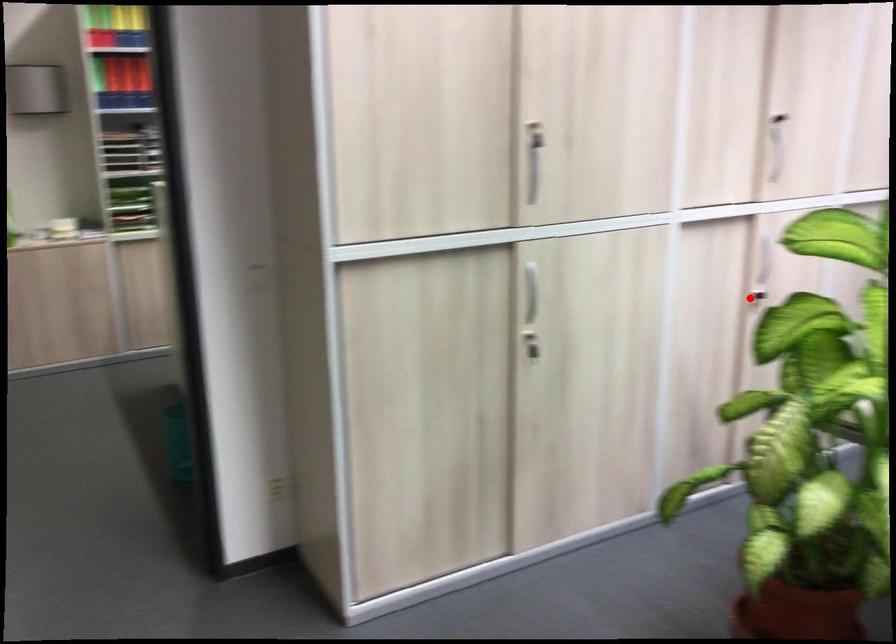
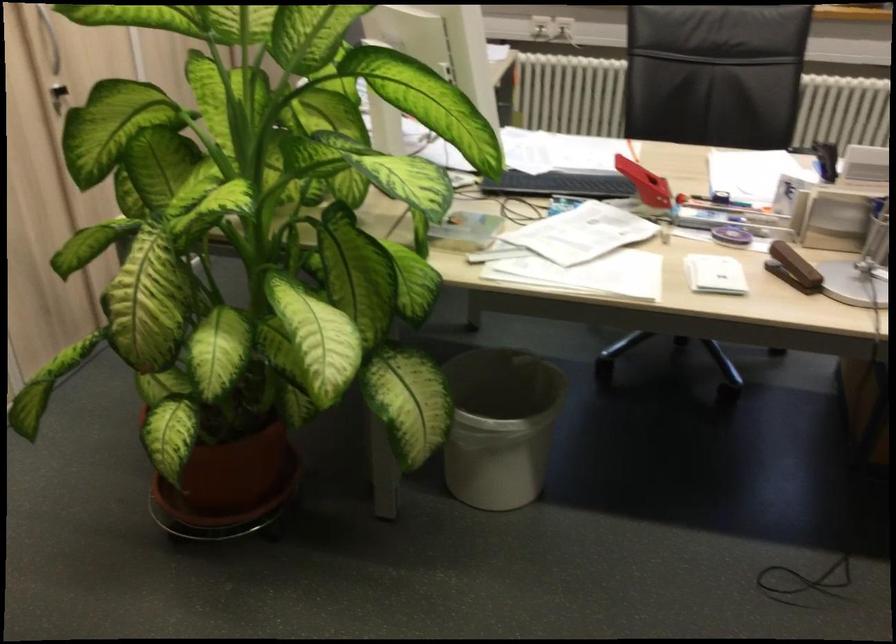
Where in the second image is the point corresponding to the highlighted location from the first image?

(57, 96)